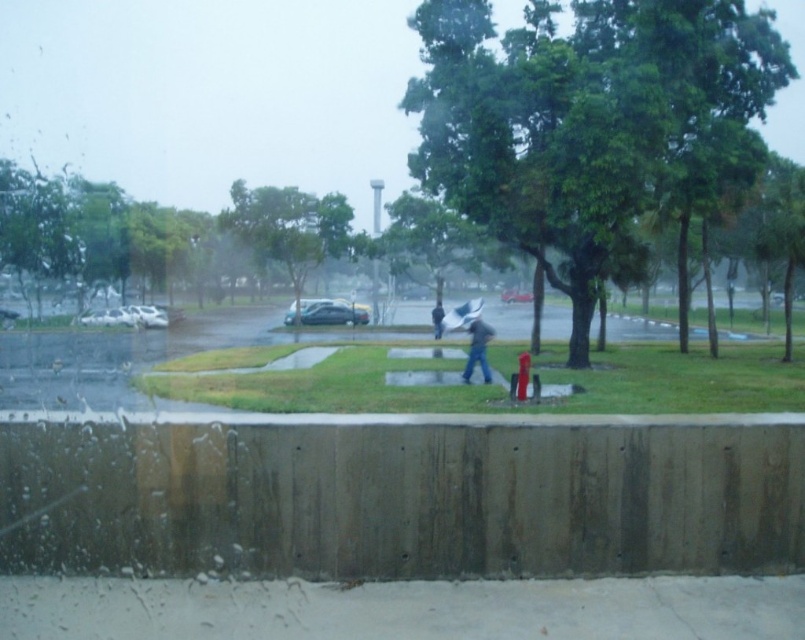
Question: Considering the real-world distances, which object is closest to the dark gray fabric jacket at center?

Choices:
 (A) shiny black sedan at center
 (B) black matte umbrella at center
 (C) gray concrete pavement at lower center
 (D) transparent plastic umbrella at center

Answer: (D)

Question: Is gray concrete pavement at lower center below transparent plastic umbrella at center?

Choices:
 (A) yes
 (B) no

Answer: (A)

Question: Where is shiny black sedan at center located in relation to dark gray fabric jacket at center in the image?

Choices:
 (A) above
 (B) below

Answer: (A)

Question: Which point is farther to the camera?

Choices:
 (A) (465, 307)
 (B) (484, 378)
 (C) (434, 336)
 (D) (327, 323)

Answer: (D)

Question: Among these points, which one is nearest to the camera?

Choices:
 (A) (473, 300)
 (B) (469, 356)
 (C) (323, 314)
 (D) (667, 604)

Answer: (D)

Question: Does gray concrete pavement at lower center come behind transparent plastic umbrella at center?

Choices:
 (A) yes
 (B) no

Answer: (B)